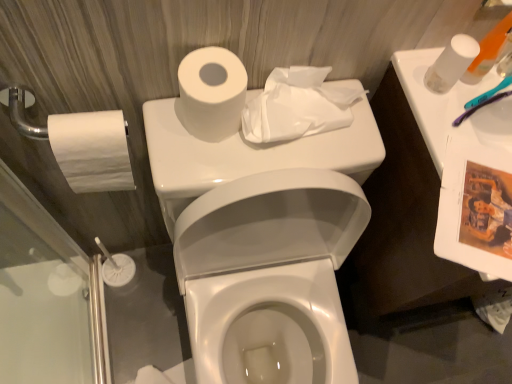
This screenshot has height=384, width=512. Find the location of `vacant space in front of white matte toilet paper at upper center, acting as the second toilet paper starting from the left`. vacant space in front of white matte toilet paper at upper center, acting as the second toilet paper starting from the left is located at coordinates (199, 161).